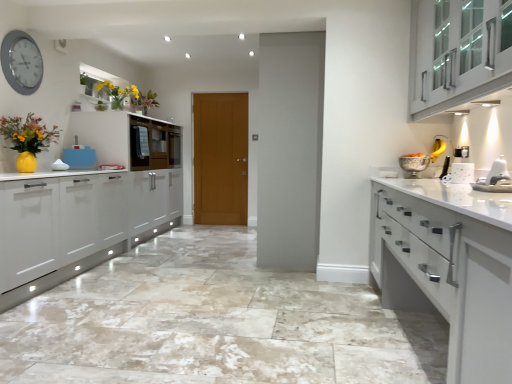
Where is `empty space that is ontop of silver metallic clock at upper left (from a real-world perspective)`? This screenshot has height=384, width=512. empty space that is ontop of silver metallic clock at upper left (from a real-world perspective) is located at coordinates (24, 33).